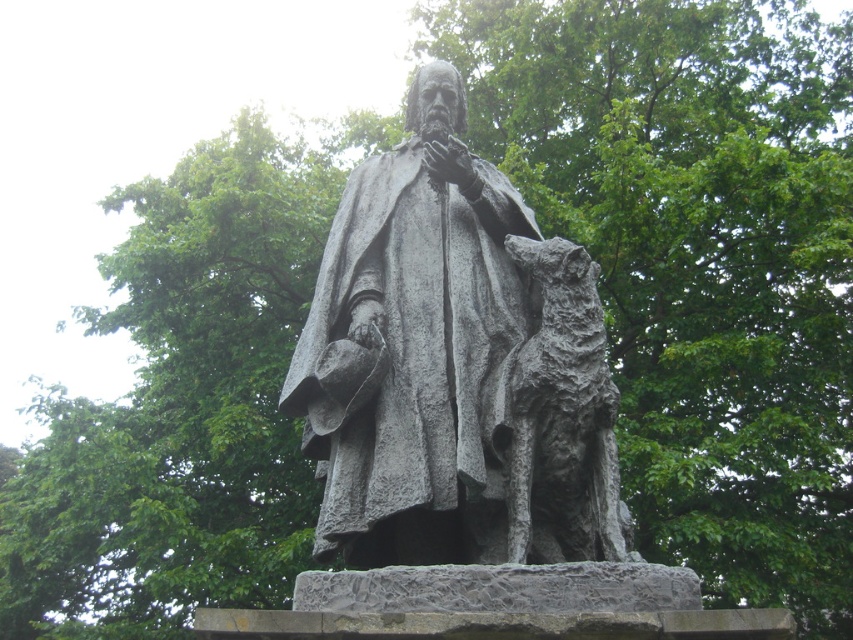
Question: Is gray stone statue at center below rough stone dog at center?

Choices:
 (A) no
 (B) yes

Answer: (A)

Question: Among these points, which one is farthest from the camera?

Choices:
 (A) (544, 422)
 (B) (300, 374)

Answer: (B)

Question: Can you confirm if gray stone statue at center is wider than rough stone dog at center?

Choices:
 (A) no
 (B) yes

Answer: (B)

Question: Can you confirm if gray stone statue at center is thinner than rough stone dog at center?

Choices:
 (A) yes
 (B) no

Answer: (B)

Question: Which point is farther to the camera?

Choices:
 (A) gray stone statue at center
 (B) rough stone dog at center

Answer: (B)

Question: Which object is closer to the camera taking this photo?

Choices:
 (A) rough stone dog at center
 (B) gray stone statue at center

Answer: (B)